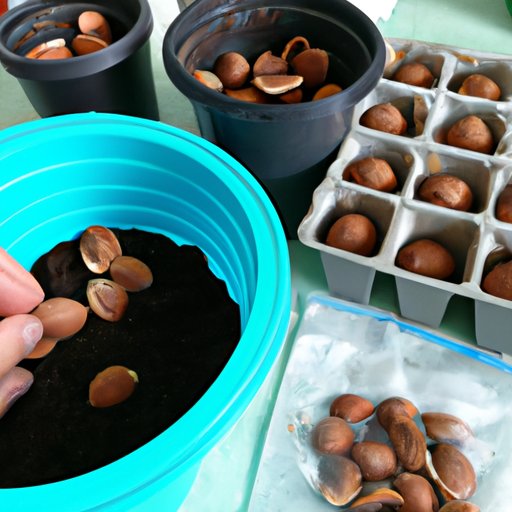
Find the location of `plastic bowl`. plastic bowl is located at coordinates (202, 185).